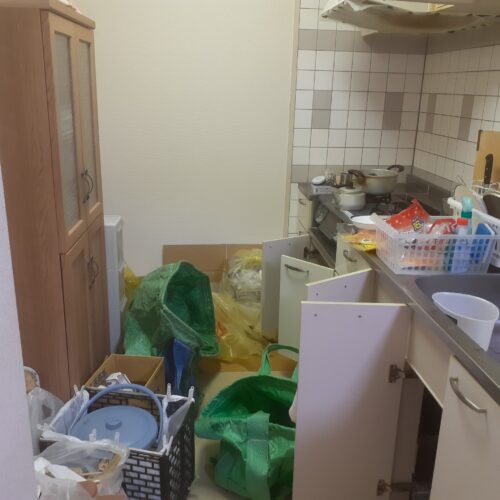
Locate an element on the screen. pot is located at coordinates (351, 198), (387, 181).